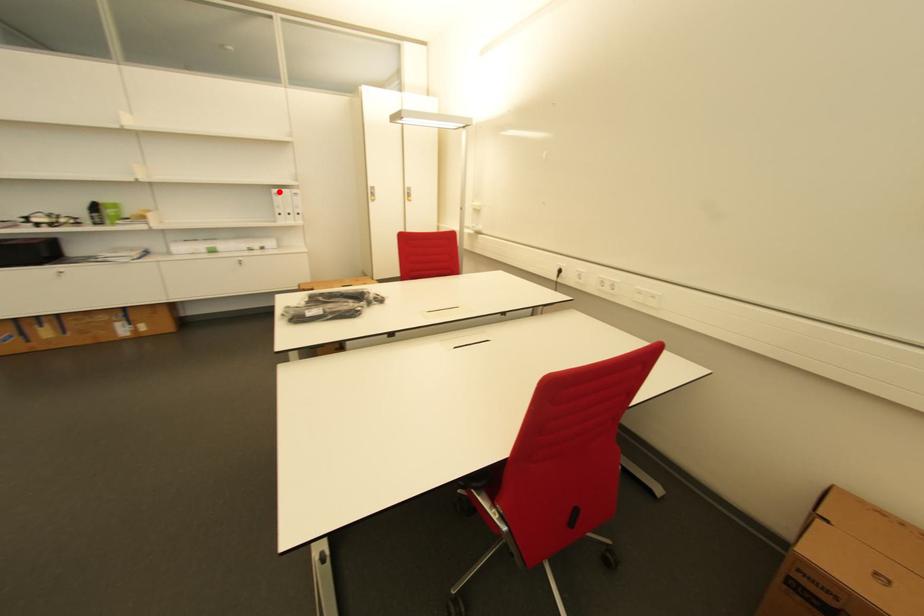
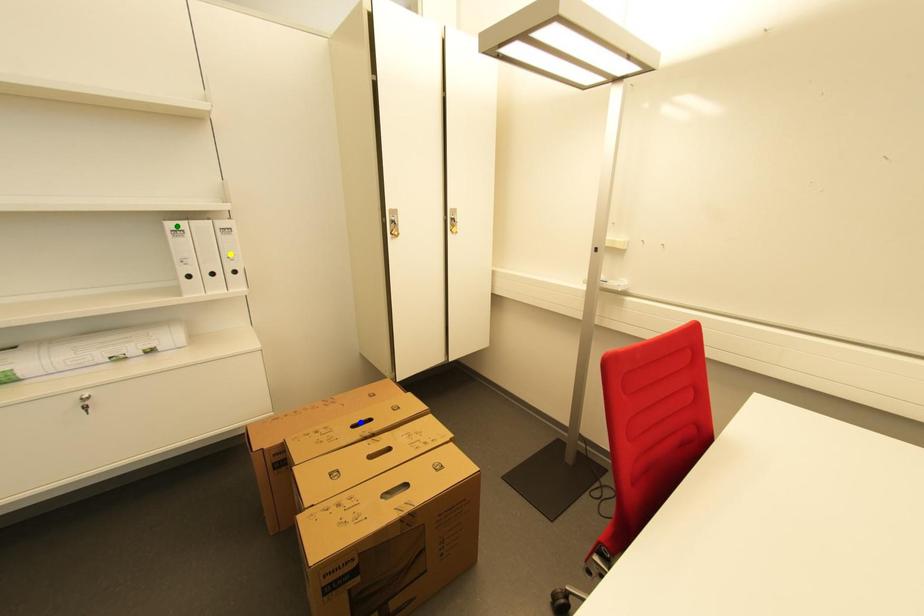
Question: I am providing you with two images of the same scene from different viewpoints. A red point is marked on the first image. You are given multiple points on the second image. In image 2, which mark is for the same physical point as the one in image 1?

Choices:
 (A) green point
 (B) blue point
 (C) yellow point

Answer: (A)